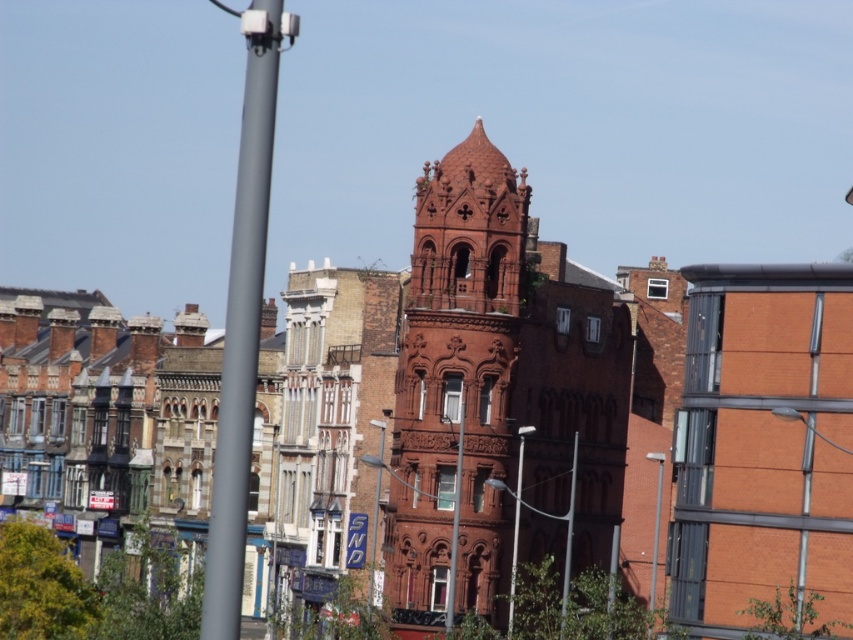
Who is positioned more to the left, matte brick tower at center or blue plastic sign at center?

From the viewer's perspective, blue plastic sign at center appears more on the left side.

Is matte brick tower at center smaller than blue plastic sign at center?

No.

Between point (422, 232) and point (364, 550), which one is positioned behind?

Point (364, 550)

In order to click on matte brick tower at center in this screenshot , I will do `click(498, 394)`.

Can you confirm if metallic gray pole at center is positioned below metallic pole at center?

No, metallic gray pole at center is not below metallic pole at center.

Can you confirm if metallic gray pole at center is positioned to the right of metallic pole at center?

Incorrect, metallic gray pole at center is not on the right side of metallic pole at center.

The width and height of the screenshot is (853, 640). In order to click on metallic gray pole at center in this screenshot , I will do `click(569, 531)`.

Is the position of matte metal pole at center more distant than that of metallic gray streetlight at center?

No, matte metal pole at center is closer to the viewer.

Which is in front, point (447, 628) or point (374, 524)?

Positioned in front is point (447, 628).

Is point (459, 417) positioned before point (363, 456)?

Yes, point (459, 417) is in front of point (363, 456).

Find the location of a particular element. The height and width of the screenshot is (640, 853). matte metal pole at center is located at coordinates (456, 513).